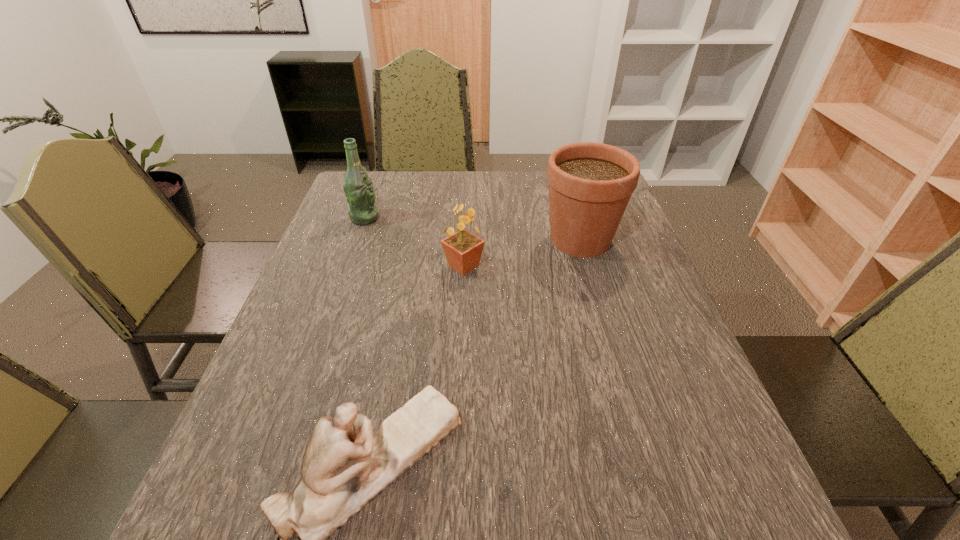
Where is `beer bottle`? The image size is (960, 540). beer bottle is located at coordinates (358, 188).

Where is `the rightmost object`? This screenshot has height=540, width=960. the rightmost object is located at coordinates (590, 184).

The image size is (960, 540). Find the location of `sunflower`. sunflower is located at coordinates (463, 250).

At what (x,y) coordinates should I click in order to perform the action: click on free space located 0.390m on the surface of the beer bottle. Please return your answer as a coordinate pair (x, y). Looking at the image, I should click on (509, 218).

I want to click on blank space located on the left of the flowerpot, so click(469, 240).

Image resolution: width=960 pixels, height=540 pixels. Find the location of `free spot located at the front of the sunflower with flowers visible`. free spot located at the front of the sunflower with flowers visible is located at coordinates (614, 266).

Identify the location of object that is at the left edge. The width and height of the screenshot is (960, 540). (358, 188).

At what (x,y) coordinates should I click in order to perform the action: click on object positioned at the right edge. Please return your answer as a coordinate pair (x, y). Looking at the image, I should click on point(590,184).

At what (x,y) coordinates should I click in order to perform the action: click on blank space at the far edge. Please return your answer as a coordinate pair (x, y). The height and width of the screenshot is (540, 960). Looking at the image, I should click on (511, 191).

This screenshot has height=540, width=960. In the image, there is a desktop. In order to click on vacant space at the near edge in this screenshot , I will do `click(450, 524)`.